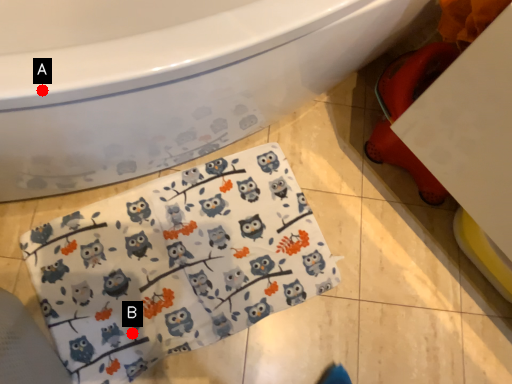
Question: Two points are circled on the image, labeled by A and B beside each circle. Which point appears farthest from the camera in this image?

Choices:
 (A) A is further
 (B) B is further

Answer: (B)